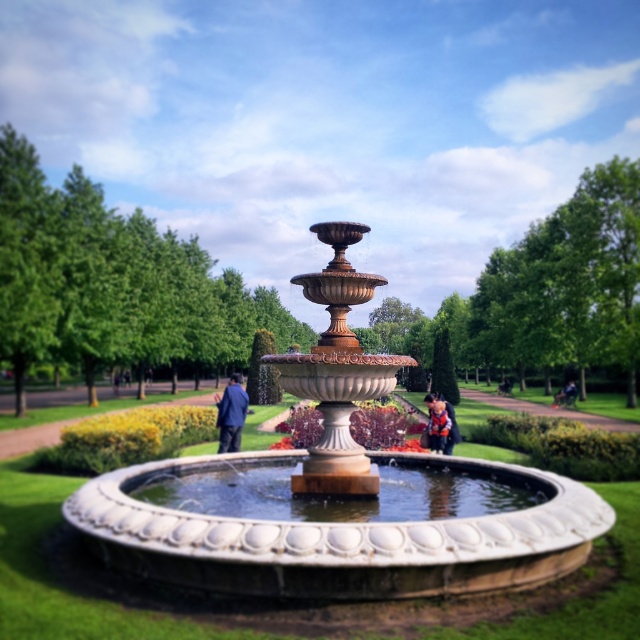
You are a park visitor who wants to place a small potted plant between the white stone fountain at center and the orange life vest at center. Based on their sizes, which object should the potted plant be closer to?

The white stone fountain at center has a lesser width compared to orange life vest at center, so the potted plant should be placed closer to the white stone fountain at center to maintain balance between the two objects.

You are a park visitor standing at the edge of the fountain. You see the blue fabric jacket at center and the orange life vest at center. Which object is closer to the water surface?

The blue fabric jacket at center is positioned under the orange life vest at center, so the blue fabric jacket at center is closer to the water surface.